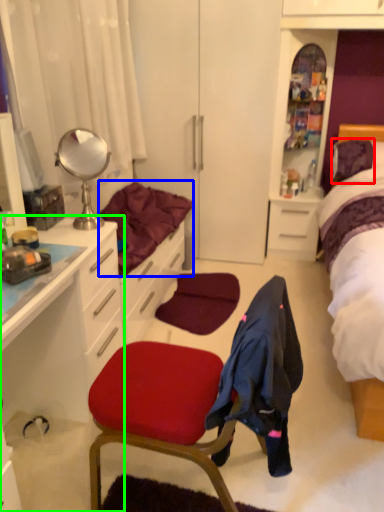
Question: Estimate the real-world distances between objects in this image. Which object is farther from pillow (highlighted by a red box), bedding (highlighted by a blue box) or cabinetry (highlighted by a green box)?

Choices:
 (A) bedding
 (B) cabinetry

Answer: (B)